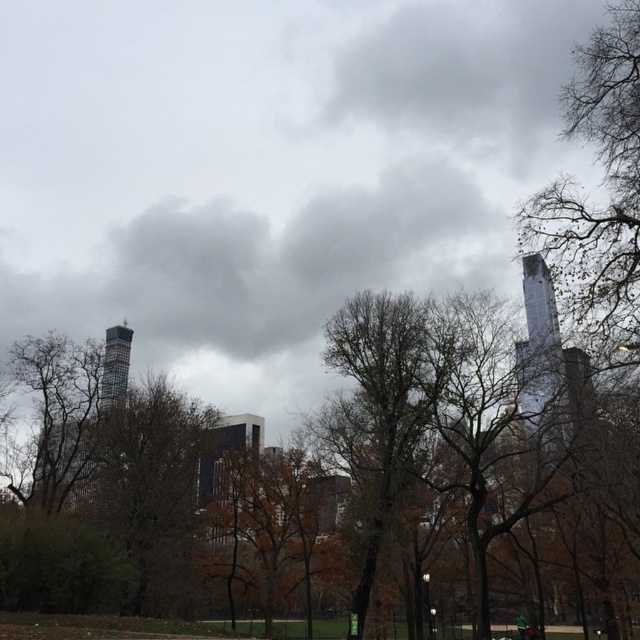
Question: Which is nearer to the glassy reflective skyscraper at center?

Choices:
 (A) brown matte tree at center
 (B) bare branches at right

Answer: (A)

Question: Can you confirm if bare branches at center is thinner than glassy reflective skyscraper at right?

Choices:
 (A) no
 (B) yes

Answer: (A)

Question: Is bare branches at center thinner than brown matte tree at center?

Choices:
 (A) no
 (B) yes

Answer: (A)

Question: Which object is closer to the camera taking this photo?

Choices:
 (A) glassy reflective skyscraper at center
 (B) bare branches at center
 (C) glassy reflective skyscraper at right

Answer: (C)

Question: Among these points, which one is farthest from the camera?

Choices:
 (A) (193, 547)
 (B) (536, 269)

Answer: (A)

Question: Can you confirm if bare branches at right is thinner than glassy reflective skyscraper at center?

Choices:
 (A) yes
 (B) no

Answer: (B)